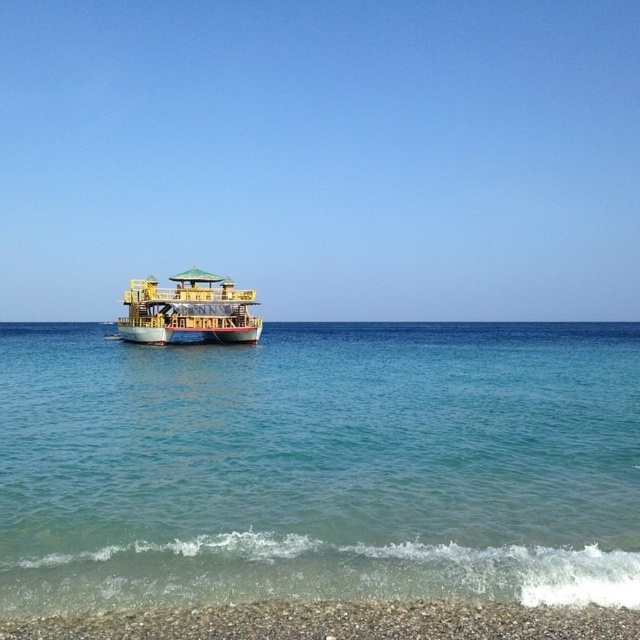
Who is positioned more to the right, clear blue water at center or yellow wooden boat at center?

clear blue water at center is more to the right.

In order to click on clear blue water at center in this screenshot , I will do `click(320, 465)`.